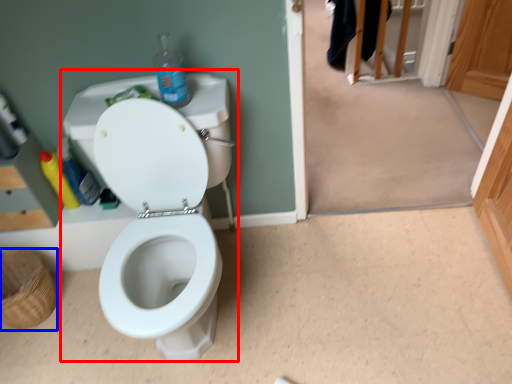
Question: Which of the following is the closest to the observer, sink (highlighted by a red box) or basket (highlighted by a blue box)?

Choices:
 (A) sink
 (B) basket

Answer: (A)